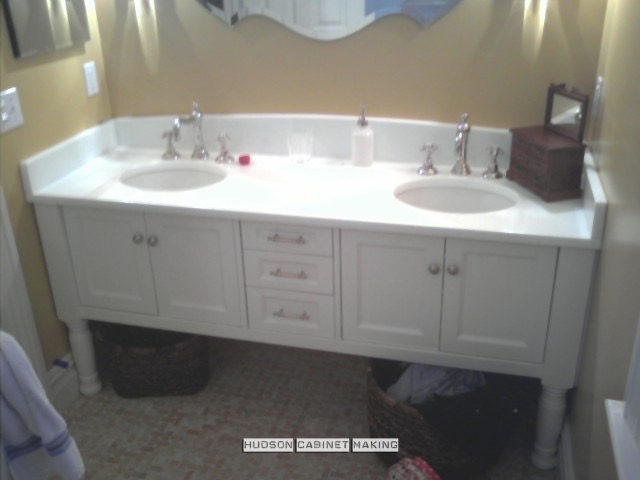
What are the coordinates of `sinks` in the screenshot? It's located at (445, 197), (188, 176).